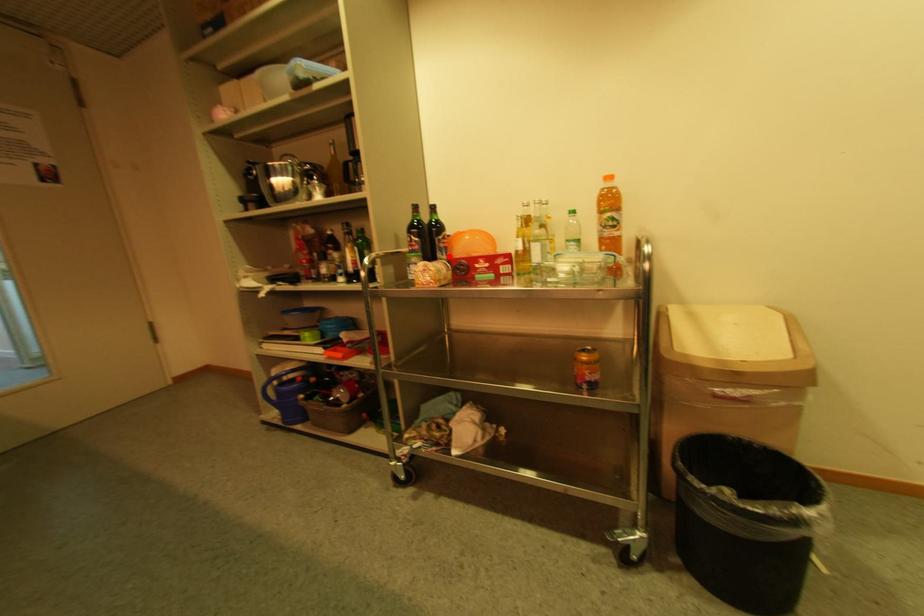
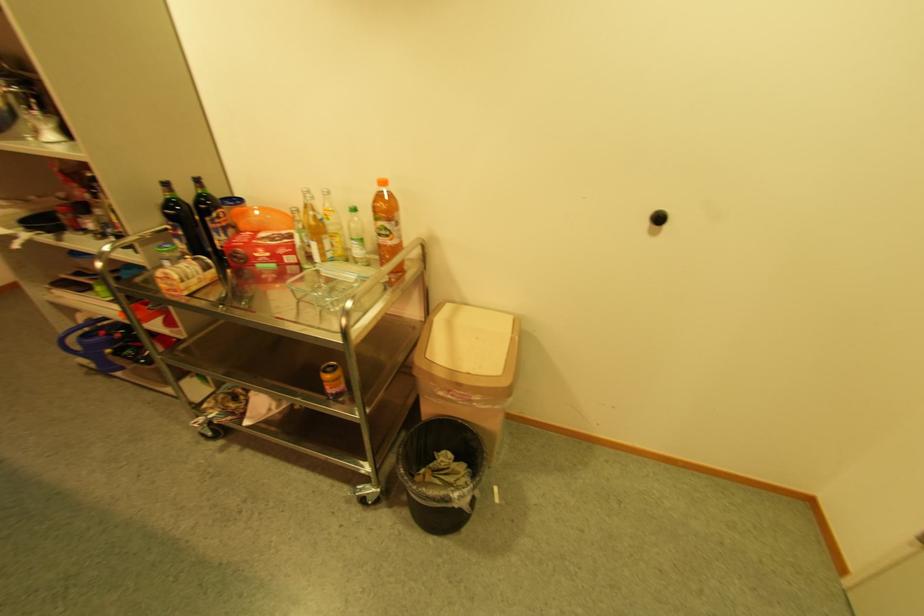
The point at the highlighted location is marked in the first image. Where is the corresponding point in the second image?

(225, 237)